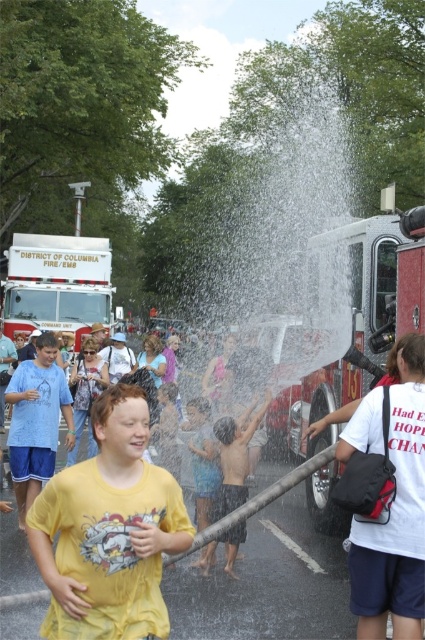
Find the location of a particular element. The image size is (425, 640). yellow matte shirt at center is located at coordinates (108, 531).

Is yellow matte shirt at center above matte blue shorts at left?

Yes.

Image resolution: width=425 pixels, height=640 pixels. Describe the element at coordinates (108, 531) in the screenshot. I see `yellow matte shirt at center` at that location.

At what (x,y) coordinates should I click in order to perform the action: click on yellow matte shirt at center. Please return your answer as a coordinate pair (x, y). This screenshot has height=640, width=425. Looking at the image, I should click on (108, 531).

Between matte blue shorts at left and shiny blue shorts at center, which one is positioned lower?

shiny blue shorts at center

Is matte blue shorts at left thinner than shiny blue shorts at center?

No.

Does point (28, 374) come closer to viewer compared to point (226, 472)?

That is False.

The width and height of the screenshot is (425, 640). Identify the location of matte blue shorts at left. (36, 420).

Does red firetruck at right have a lesser width compared to white matte fire truck at upper left?

Correct, red firetruck at right's width is less than white matte fire truck at upper left's.

Between point (345, 364) and point (96, 256), which one is positioned behind?

The point (96, 256) is behind.

I want to click on red firetruck at right, so click(x=365, y=317).